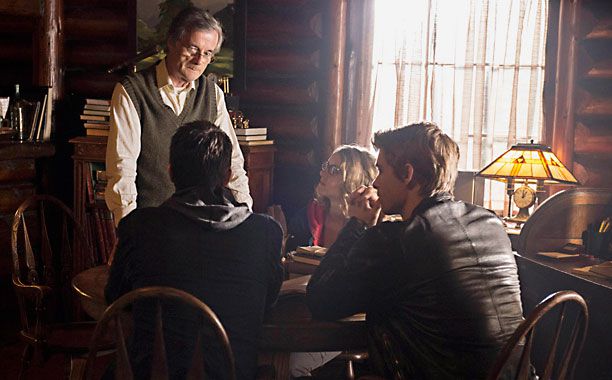
At what (x,y) coordinates should I click in order to perform the action: click on bookcase. Please return your answer as a coordinate pair (x, y). The width and height of the screenshot is (612, 380). Looking at the image, I should click on (81, 153).